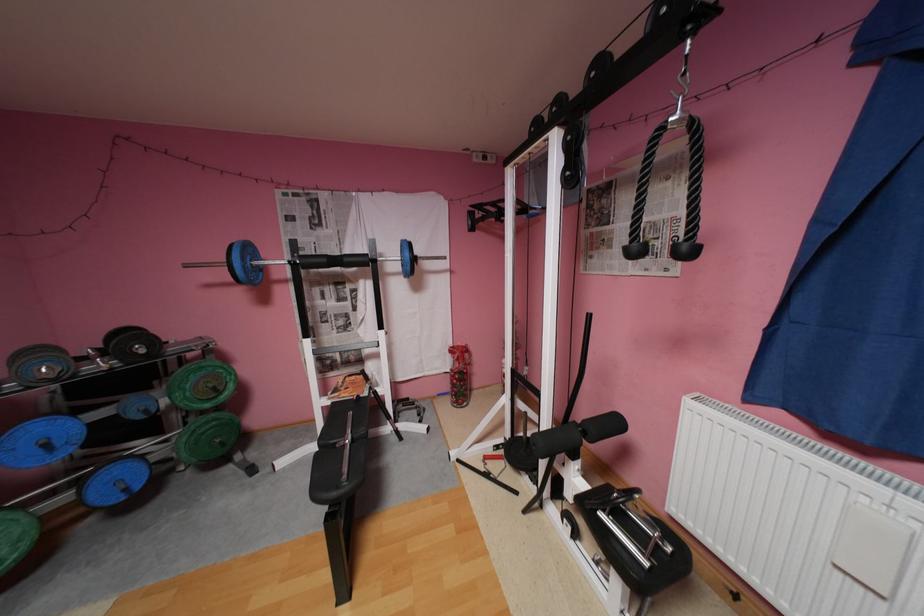
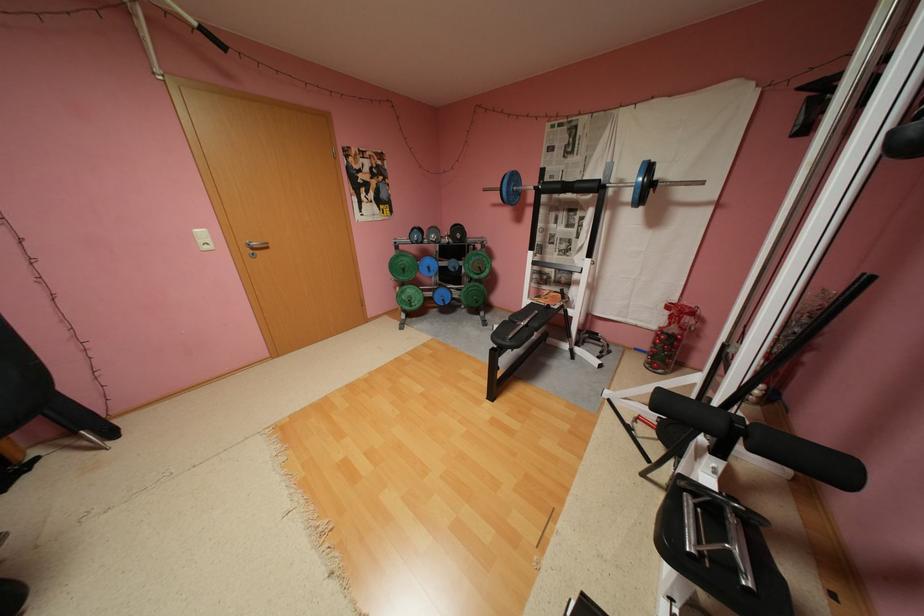
Find the pixel in the second image that matches (x=71, y=499) in the first image.

(439, 294)